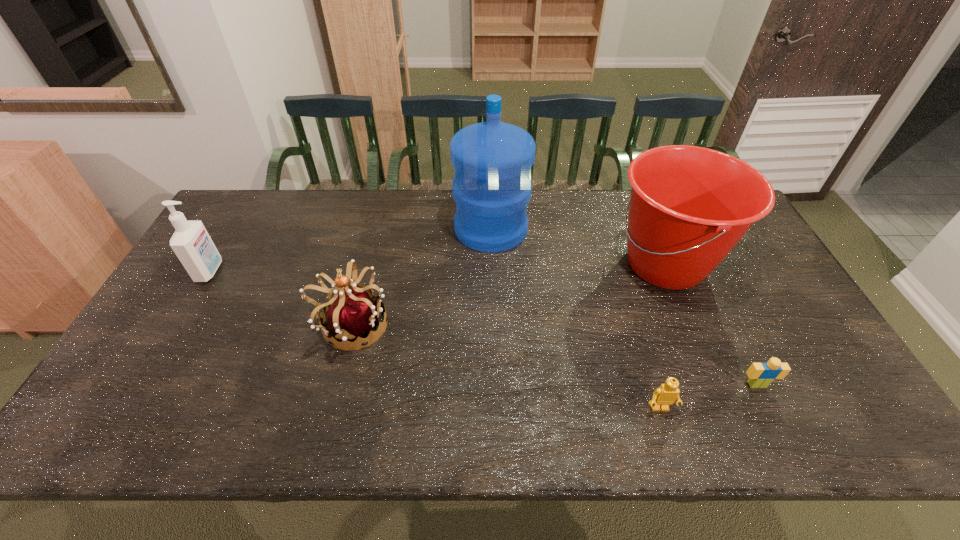
Find the location of a particular element. The width and height of the screenshot is (960, 540). object present at the near edge is located at coordinates (664, 396).

You are a GUI agent. You are given a task and a screenshot of the screen. Output one action in this format:
    pyautogui.click(x=<x>, y=<y>)
    Task: Click on the object present at the left edge
    The image size is (960, 540).
    Given the screenshot: What is the action you would take?
    pyautogui.click(x=191, y=242)

The width and height of the screenshot is (960, 540). I want to click on object at the right edge, so click(689, 206).

Image resolution: width=960 pixels, height=540 pixels. What are the coordinates of `object positioned at the far right corner` in the screenshot? It's located at (689, 206).

Locate an element on the screen. The height and width of the screenshot is (540, 960). free region at the far edge is located at coordinates (404, 229).

The height and width of the screenshot is (540, 960). Find the location of `free space at the near edge`. free space at the near edge is located at coordinates (544, 420).

Locate an element on the screen. vacant space at the left edge of the desktop is located at coordinates (259, 236).

This screenshot has height=540, width=960. In order to click on vacant space at the right edge of the desktop in this screenshot , I will do `click(805, 338)`.

The width and height of the screenshot is (960, 540). In the image, there is a desktop. In order to click on blank space at the far left corner in this screenshot , I will do `click(262, 208)`.

Locate an element on the screen. This screenshot has height=540, width=960. free space between the nearer Lego and the right Lego is located at coordinates (708, 396).